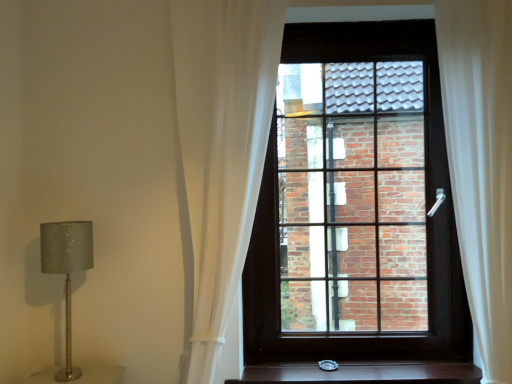
Question: Can you confirm if white sheer curtain at center, the 2th curtain in the right-to-left sequence, is thinner than matte dark wood window at center?

Choices:
 (A) yes
 (B) no

Answer: (B)

Question: Are white sheer curtain at center, the 1th curtain when ordered from left to right, and matte dark wood window at center making contact?

Choices:
 (A) no
 (B) yes

Answer: (A)

Question: Would you say white sheer curtain at center, the 1th curtain when ordered from left to right, contains matte dark wood window at center?

Choices:
 (A) yes
 (B) no

Answer: (B)

Question: From a real-world perspective, is white sheer curtain at center, the 1th curtain when ordered from left to right, over matte dark wood window at center?

Choices:
 (A) no
 (B) yes

Answer: (B)

Question: Can you confirm if white sheer curtain at center, the 2th curtain in the right-to-left sequence, is bigger than matte dark wood window at center?

Choices:
 (A) yes
 (B) no

Answer: (B)

Question: Is white sheer curtain at center, the 1th curtain when ordered from left to right, taller than matte dark wood window at center?

Choices:
 (A) yes
 (B) no

Answer: (A)

Question: Does matte dark wood window at center appear on the right side of white sheer curtain at center, the 2th curtain in the right-to-left sequence?

Choices:
 (A) yes
 (B) no

Answer: (A)

Question: Could you tell me if matte dark wood window at center is facing white sheer curtain at center, the 1th curtain when ordered from left to right?

Choices:
 (A) no
 (B) yes

Answer: (B)

Question: Is matte dark wood window at center looking in the opposite direction of white sheer curtain at center, the 2th curtain in the right-to-left sequence?

Choices:
 (A) yes
 (B) no

Answer: (B)

Question: Is matte dark wood window at center positioned before white sheer curtain at center, the 2th curtain in the right-to-left sequence?

Choices:
 (A) no
 (B) yes

Answer: (A)

Question: Is matte dark wood window at center taller than white sheer curtain at center, the 2th curtain in the right-to-left sequence?

Choices:
 (A) no
 (B) yes

Answer: (A)

Question: From a real-world perspective, is matte dark wood window at center positioned under white sheer curtain at center, the 2th curtain in the right-to-left sequence, based on gravity?

Choices:
 (A) no
 (B) yes

Answer: (B)

Question: Is wooden stair treads at lower center not inside silver textured lamp at left?

Choices:
 (A) yes
 (B) no

Answer: (A)